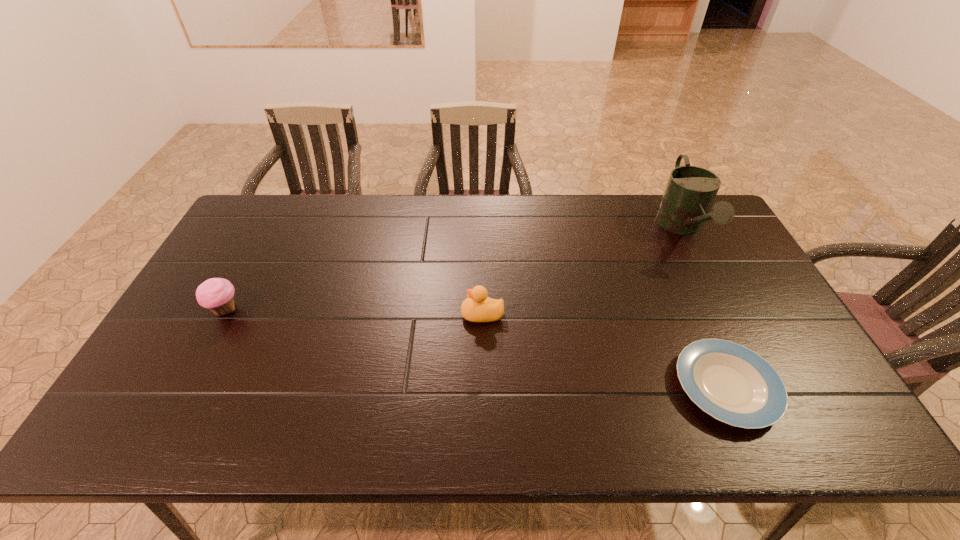
Image resolution: width=960 pixels, height=540 pixels. In order to click on free space between the third object from right to left and the plate in this screenshot , I will do `click(604, 350)`.

Locate an element on the screen. vacant space that is in between the plate and the watering can is located at coordinates (705, 308).

Find the location of a particular element. The image size is (960, 540). object that is the third closest to the second object from left to right is located at coordinates (217, 294).

Select which object appears as the third closest to the third object from right to left. Please provide its 2D coordinates. Your answer should be formatted as a tuple, i.e. [(x, y)], where the tuple contains the x and y coordinates of a point satisfying the conditions above.

[(217, 294)]

Where is `vacant space that satisfies the following two spatial constraints: 1. on the face of the plate; 2. on the right side of the second object from left to right`? vacant space that satisfies the following two spatial constraints: 1. on the face of the plate; 2. on the right side of the second object from left to right is located at coordinates click(483, 387).

Identify the location of vacant area in the image that satisfies the following two spatial constraints: 1. on the back side of the nearest object; 2. on the face of the duck. The image size is (960, 540). (694, 314).

Where is `free location that satisfies the following two spatial constraints: 1. with the spout on the farthest object; 2. on the face of the third object from right to left`? The image size is (960, 540). free location that satisfies the following two spatial constraints: 1. with the spout on the farthest object; 2. on the face of the third object from right to left is located at coordinates (727, 314).

Locate an element on the screen. vacant area that satisfies the following two spatial constraints: 1. on the face of the third object from right to left; 2. on the left side of the plate is located at coordinates (483, 387).